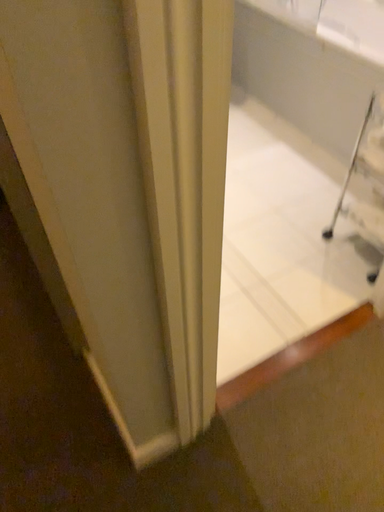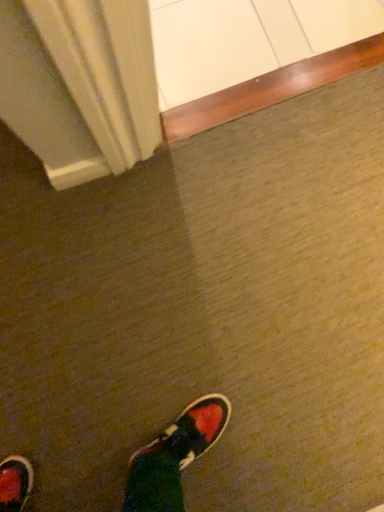
Question: How did the camera likely rotate when shooting the video?

Choices:
 (A) rotated downward
 (B) rotated upward

Answer: (A)